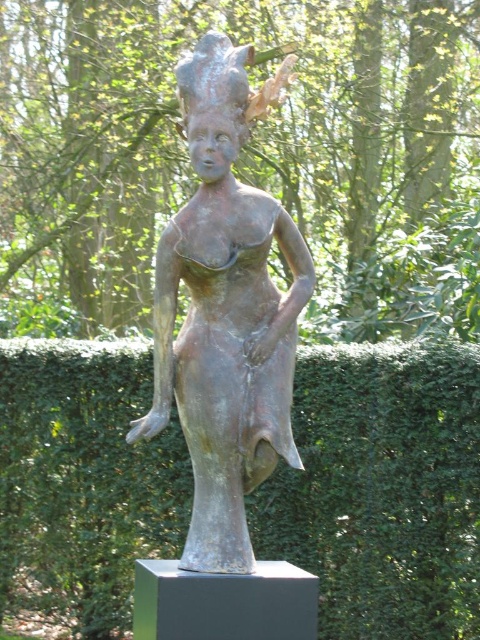
Question: Can you confirm if green leafy hedge at center is wider than bronze statue at center?

Choices:
 (A) yes
 (B) no

Answer: (A)

Question: Which of the following is the closest to the observer?

Choices:
 (A) bronze statue at center
 (B) green leafy hedge at center

Answer: (A)

Question: Which point is farther from the camera taking this photo?

Choices:
 (A) (229, 536)
 (B) (349, 400)

Answer: (B)

Question: Can you confirm if green leafy hedge at center is wider than bronze statue at center?

Choices:
 (A) no
 (B) yes

Answer: (B)

Question: Does green leafy hedge at center have a smaller size compared to bronze statue at center?

Choices:
 (A) yes
 (B) no

Answer: (B)

Question: Which object is closer to the camera taking this photo?

Choices:
 (A) green leafy hedge at center
 (B) bronze statue at center

Answer: (B)